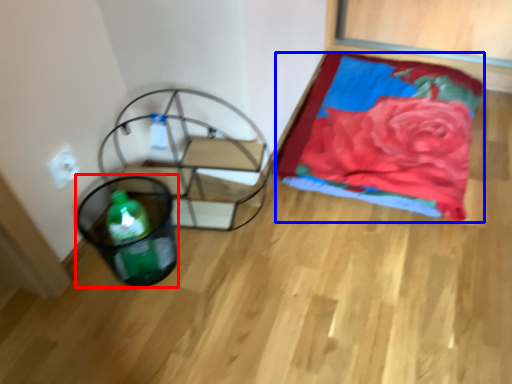
Question: Which of the following is the farthest to the observer, basket (highlighted by a red box) or blanket (highlighted by a blue box)?

Choices:
 (A) basket
 (B) blanket

Answer: (B)